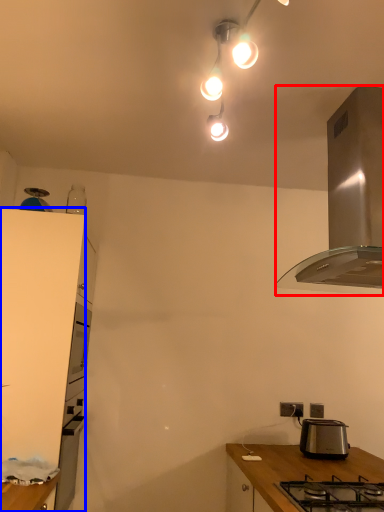
Question: Which object appears farthest to the camera in this image, kitchen appliance (highlighted by a red box) or cabinetry (highlighted by a blue box)?

Choices:
 (A) kitchen appliance
 (B) cabinetry

Answer: (B)